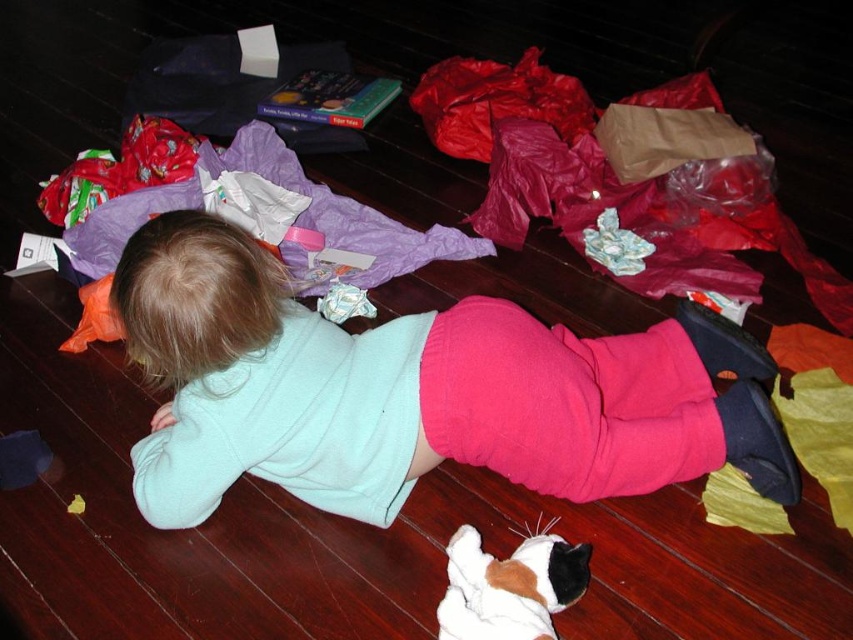
You are a parent looking for your child. You see the point at coordinates (x=415, y=392). Where is this point located in relation to the child?

The point at coordinates (x=415, y=392) is located on the light blue fleece at center, which is where the child is lying.

You are a parent looking for your child who is playing on the floor. You see the light blue fleece at center and the white plush cat at lower center. Which object is closer to the left side of the scene?

The light blue fleece at center is positioned to the left of the white plush cat at lower center, so it is closer to the left side of the scene.

You are a parent trying to clean up the floor. You see the light blue fleece at center and the white plush cat at lower center. Which item should you pick up first if you want to pick up the wider item first?

The light blue fleece at center is wider than the white plush cat at lower center, so you should pick up the light blue fleece at center first.